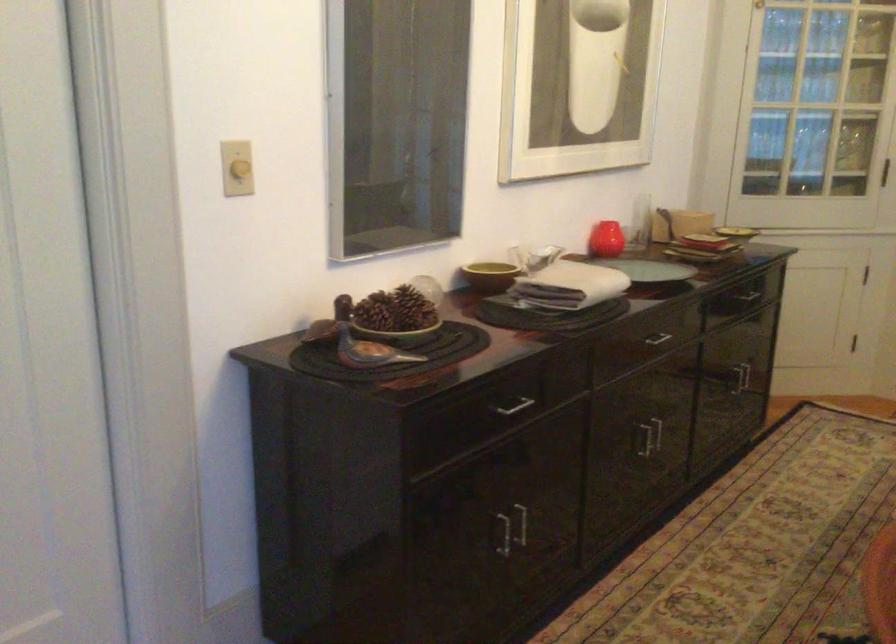
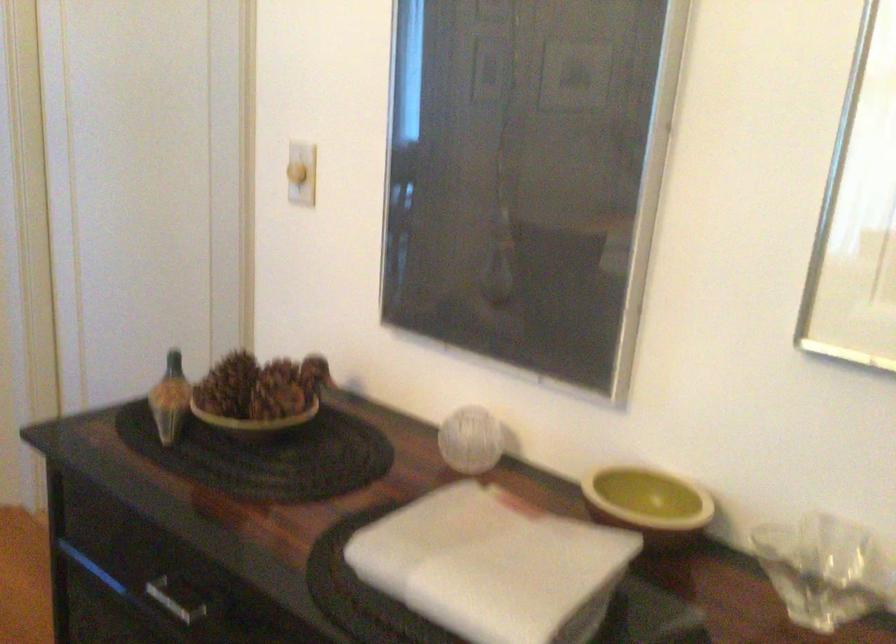
Locate, in the second image, the point that corresponds to (x=509, y=406) in the first image.

(177, 598)